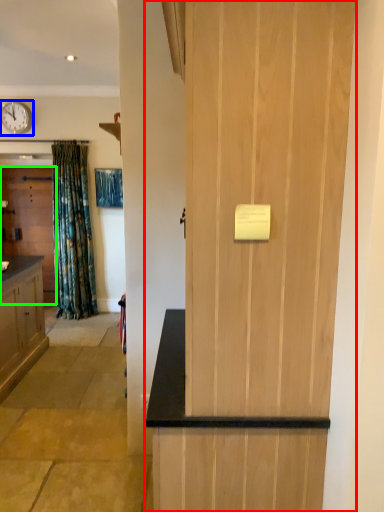
Question: Estimate the real-world distances between objects in this image. Which object is closer to door (highlighted by a red box), clock (highlighted by a blue box) or door (highlighted by a green box)?

Choices:
 (A) clock
 (B) door

Answer: (B)